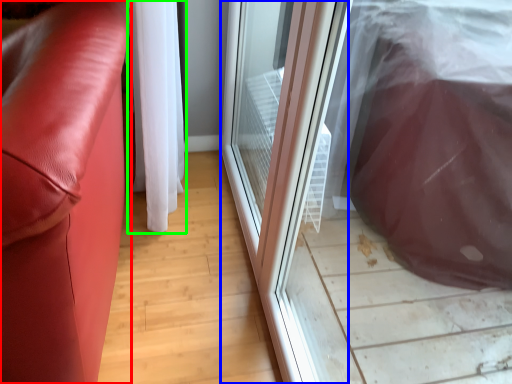
Question: Estimate the real-world distances between objects in this image. Which object is farther from furniture (highlighted by a red box), screen door (highlighted by a blue box) or curtain (highlighted by a green box)?

Choices:
 (A) screen door
 (B) curtain

Answer: (A)